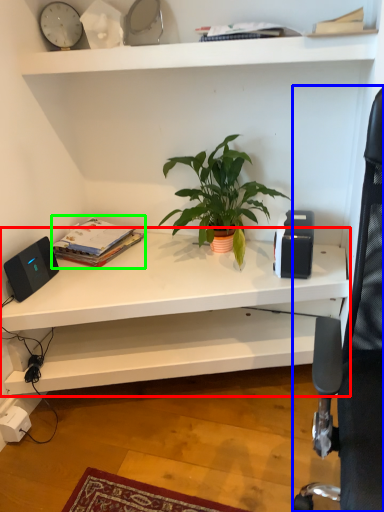
Question: Estimate the real-world distances between objects in this image. Which object is farther from shelf (highlighted by a red box), computer chair (highlighted by a blue box) or paperback book (highlighted by a green box)?

Choices:
 (A) computer chair
 (B) paperback book

Answer: (A)